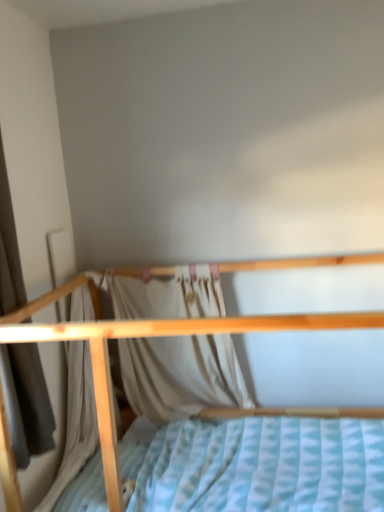
Question: Is white fabric curtain at center, which ranks as the first curtain in back-to-front order, wider than light beige fabric curtain at left, which ranks as the first curtain in left-to-right order?

Choices:
 (A) no
 (B) yes

Answer: (A)

Question: Are white fabric curtain at center, which is the 1th curtain in right-to-left order, and light beige fabric curtain at left, which ranks as the first curtain in left-to-right order, far apart?

Choices:
 (A) no
 (B) yes

Answer: (A)

Question: Does white fabric curtain at center, the second curtain when ordered from front to back, come in front of light beige fabric curtain at left, which ranks as the first curtain in front-to-back order?

Choices:
 (A) no
 (B) yes

Answer: (A)

Question: Is white fabric curtain at center, the second curtain when ordered from front to back, to the right of light beige fabric curtain at left, positioned as the 2th curtain in right-to-left order, from the viewer's perspective?

Choices:
 (A) no
 (B) yes

Answer: (B)

Question: Is white fabric curtain at center, marked as the second curtain in a left-to-right arrangement, not within light beige fabric curtain at left, positioned as the 2th curtain in right-to-left order?

Choices:
 (A) no
 (B) yes

Answer: (B)

Question: From a real-world perspective, is wooden bed at center above or below light beige fabric curtain at left, which ranks as the first curtain in front-to-back order?

Choices:
 (A) above
 (B) below

Answer: (B)

Question: Is wooden bed at center wider or thinner than light beige fabric curtain at left, which is the second curtain from back to front?

Choices:
 (A) thin
 (B) wide

Answer: (B)

Question: Is wooden bed at center taller or shorter than light beige fabric curtain at left, which ranks as the first curtain in front-to-back order?

Choices:
 (A) short
 (B) tall

Answer: (A)

Question: Which is correct: wooden bed at center is inside light beige fabric curtain at left, which ranks as the first curtain in front-to-back order, or outside of it?

Choices:
 (A) outside
 (B) inside

Answer: (A)

Question: Is wooden bed at center situated inside white fabric curtain at center, which ranks as the first curtain in back-to-front order, or outside?

Choices:
 (A) outside
 (B) inside

Answer: (A)

Question: In terms of size, does wooden bed at center appear bigger or smaller than white fabric curtain at center, which ranks as the first curtain in back-to-front order?

Choices:
 (A) small
 (B) big

Answer: (B)

Question: From the image's perspective, is wooden bed at center located above or below white fabric curtain at center, which is the 1th curtain in right-to-left order?

Choices:
 (A) below
 (B) above

Answer: (A)

Question: Considering the positions of wooden bed at center and white fabric curtain at center, the second curtain when ordered from front to back, in the image, is wooden bed at center taller or shorter than white fabric curtain at center, the second curtain when ordered from front to back,?

Choices:
 (A) short
 (B) tall

Answer: (B)

Question: Does point click(223, 352) appear closer or farther from the camera than point click(317, 313)?

Choices:
 (A) closer
 (B) farther

Answer: (B)

Question: Relative to wooden bed at center, is white fabric curtain at center, which ranks as the first curtain in back-to-front order, in front or behind?

Choices:
 (A) behind
 (B) front

Answer: (A)